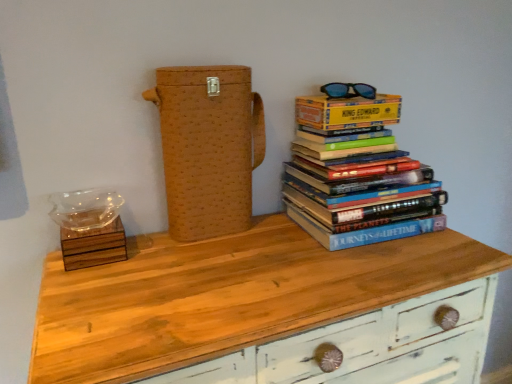
The width and height of the screenshot is (512, 384). I want to click on vacant space in front of hardcover books at upper right, so click(x=372, y=259).